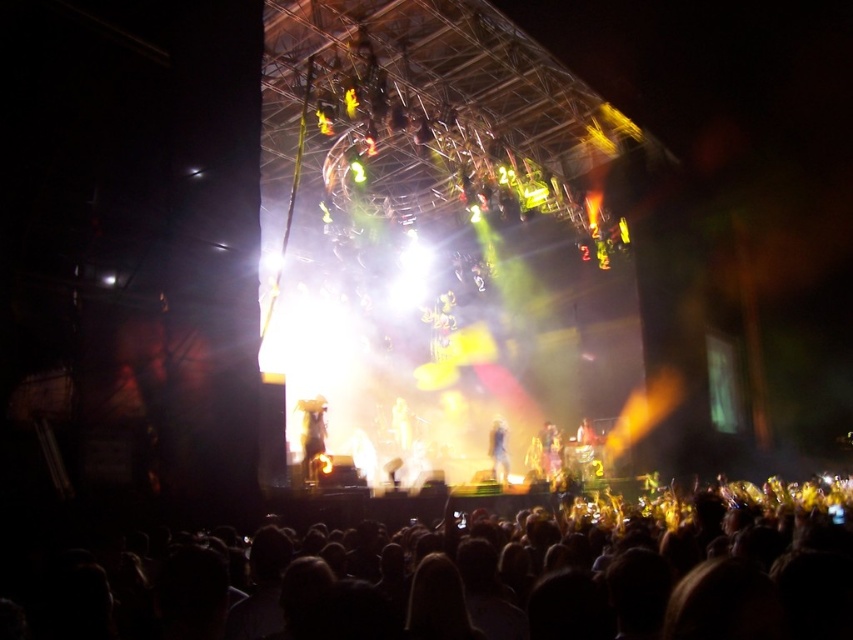
Question: Does dark hair at lower center come behind smooth white statue at center?

Choices:
 (A) yes
 (B) no

Answer: (B)

Question: Estimate the real-world distances between objects in this image. Which object is closer to the dark hair at lower center?

Choices:
 (A) smooth white statue at center
 (B) smooth skin figure at center

Answer: (B)

Question: Observing the image, what is the correct spatial positioning of smooth skin figure at center in reference to smooth white statue at center?

Choices:
 (A) left
 (B) right

Answer: (B)

Question: Can you confirm if dark hair at lower center is wider than smooth skin figure at center?

Choices:
 (A) no
 (B) yes

Answer: (B)

Question: Which point is closer to the camera?

Choices:
 (A) (599, 518)
 (B) (492, 468)
 (C) (405, 445)

Answer: (A)

Question: Which point is farther to the camera?

Choices:
 (A) pos(689,564)
 (B) pos(393,435)
 (C) pos(502,452)

Answer: (B)